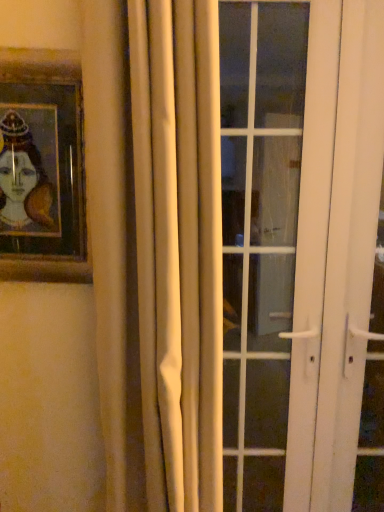
Measure the distance between point (56,125) and camera.

Point (56,125) and camera are 99.70 centimeters apart.

At what (x,y) coordinates should I click in order to perform the action: click on white matte curtain at center. Please return your answer as a coordinate pair (x, y). The image size is (384, 512). Looking at the image, I should click on (179, 247).

Considering the positions of point (289, 387) and point (150, 252), is point (289, 387) closer or farther from the camera than point (150, 252)?

Point (289, 387).

How much distance is there between white glass door at center and white matte curtain at center?

white glass door at center is 1.03 meters away from white matte curtain at center.

Does white glass door at center appear on the right side of white matte curtain at center?

Correct, you'll find white glass door at center to the right of white matte curtain at center.

Is white glass door at center spatially inside white matte curtain at center, or outside of it?

white glass door at center is located beyond the bounds of white matte curtain at center.

Considering the sizes of objects white glass door at center and wooden framed portrait at upper left in the image provided, who is thinner, white glass door at center or wooden framed portrait at upper left?

With smaller width is wooden framed portrait at upper left.

From the picture: Could wooden framed portrait at upper left be considered to be inside white glass door at center?

No, wooden framed portrait at upper left is located outside of white glass door at center.

Is white glass door at center facing towards wooden framed portrait at upper left?

No, white glass door at center is not facing towards wooden framed portrait at upper left.

Is white matte curtain at center positioned far away from white glass door at center?

white matte curtain at center is positioned a significant distance from white glass door at center.

Locate an element on the screen. curtain in front of the white glass door at center is located at coordinates (179, 247).

From a real-world perspective, is white matte curtain at center positioned under white glass door at center based on gravity?

No, from a real-world perspective, white matte curtain at center is not under white glass door at center.

Where is `picture frame behind the white matte curtain at center`? The width and height of the screenshot is (384, 512). picture frame behind the white matte curtain at center is located at coordinates (42, 167).

Between wooden framed portrait at upper left and white matte curtain at center, which one is positioned behind?

wooden framed portrait at upper left is further away from the camera.

Is white matte curtain at center a part of wooden framed portrait at upper left?

No.

Is point (10, 126) closer or farther from the camera than point (221, 377)?

Point (10, 126) is farther from the camera than point (221, 377).

Who is smaller, wooden framed portrait at upper left or white glass door at center?

Smaller between the two is wooden framed portrait at upper left.

From a real-world perspective, relative to white glass door at center, is wooden framed portrait at upper left vertically above or below?

Clearly, from a real-world perspective, wooden framed portrait at upper left is above white glass door at center.

Considering the sizes of objects wooden framed portrait at upper left and white glass door at center in the image provided, who is taller, wooden framed portrait at upper left or white glass door at center?

Standing taller between the two is white glass door at center.

Is white matte curtain at center not within wooden framed portrait at upper left?

white matte curtain at center lies outside wooden framed portrait at upper left's area.

Is white matte curtain at center bigger than wooden framed portrait at upper left?

Yes.

Is point (147, 117) behind point (44, 280)?

That is False.

Looking at this image, from the image's perspective, between white matte curtain at center and wooden framed portrait at upper left, which one is located above?

wooden framed portrait at upper left is shown above in the image.

You are a GUI agent. You are given a task and a screenshot of the screen. Output one action in this format:
    pyautogui.click(x=<x>, y=<y>)
    Task: Click on the door that is below the white matte curtain at center (from the image's perspective)
    This screenshot has width=384, height=512.
    Given the screenshot: What is the action you would take?
    pyautogui.click(x=274, y=241)

The image size is (384, 512). I want to click on picture frame on the left of white glass door at center, so click(42, 167).

Which object lies nearer to the anchor point white glass door at center, white matte curtain at center or wooden framed portrait at upper left?

Based on the image, white matte curtain at center appears to be nearer to white glass door at center.

Consider the image. From the image, which object appears to be farther from white glass door at center, wooden framed portrait at upper left or white matte curtain at center?

wooden framed portrait at upper left.

Considering their positions, is white glass door at center positioned further to white matte curtain at center than wooden framed portrait at upper left?

white glass door at center.

From the picture: From the image, which object appears to be nearer to white matte curtain at center, wooden framed portrait at upper left or white glass door at center?

wooden framed portrait at upper left is positioned closer to the anchor white matte curtain at center.

Looking at the image, which one is located closer to wooden framed portrait at upper left, white glass door at center or white matte curtain at center?

white matte curtain at center is closer to wooden framed portrait at upper left.

Estimate the real-world distances between objects in this image. Which object is closer to wooden framed portrait at upper left, white matte curtain at center or white glass door at center?

white matte curtain at center lies closer to wooden framed portrait at upper left than the other object.

Identify the location of curtain between wooden framed portrait at upper left and white glass door at center from left to right. The width and height of the screenshot is (384, 512). (179, 247).